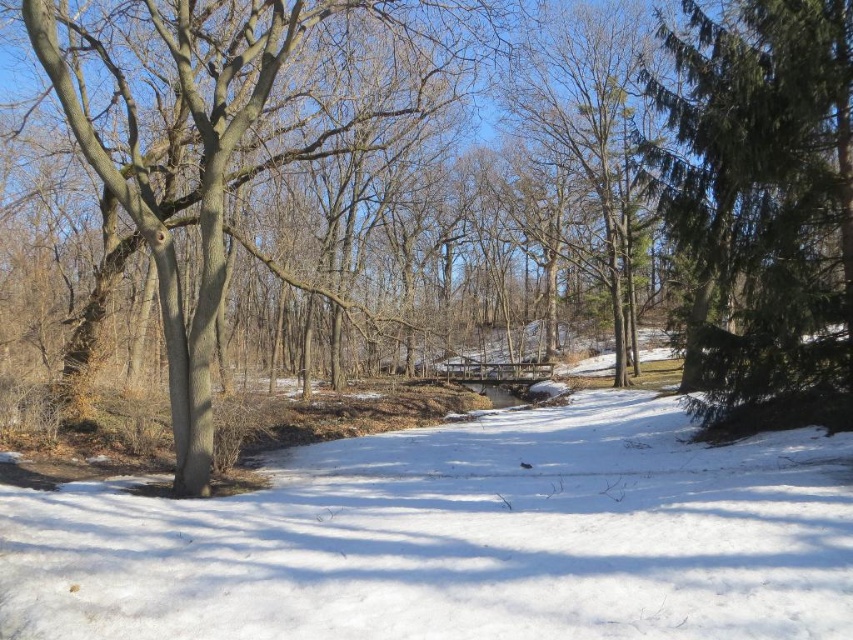
Question: Estimate the real-world distances between objects in this image. Which object is farther from the brown bark tree at left?

Choices:
 (A) green needle-like tree at right
 (B) white powdery snow at center

Answer: (A)

Question: Which point appears closest to the camera in this image?

Choices:
 (A) (274, 8)
 (B) (430, 502)

Answer: (B)

Question: From the image, what is the correct spatial relationship of white powdery snow at center in relation to green needle-like tree at right?

Choices:
 (A) left
 (B) right

Answer: (A)

Question: Is green needle-like tree at right positioned at the back of brown bark tree at left?

Choices:
 (A) yes
 (B) no

Answer: (A)

Question: Based on their relative distances, which object is nearer to the white powdery snow at center?

Choices:
 (A) brown bark tree at left
 (B) green needle-like tree at right

Answer: (A)

Question: Is white powdery snow at center positioned behind green needle-like tree at right?

Choices:
 (A) no
 (B) yes

Answer: (A)